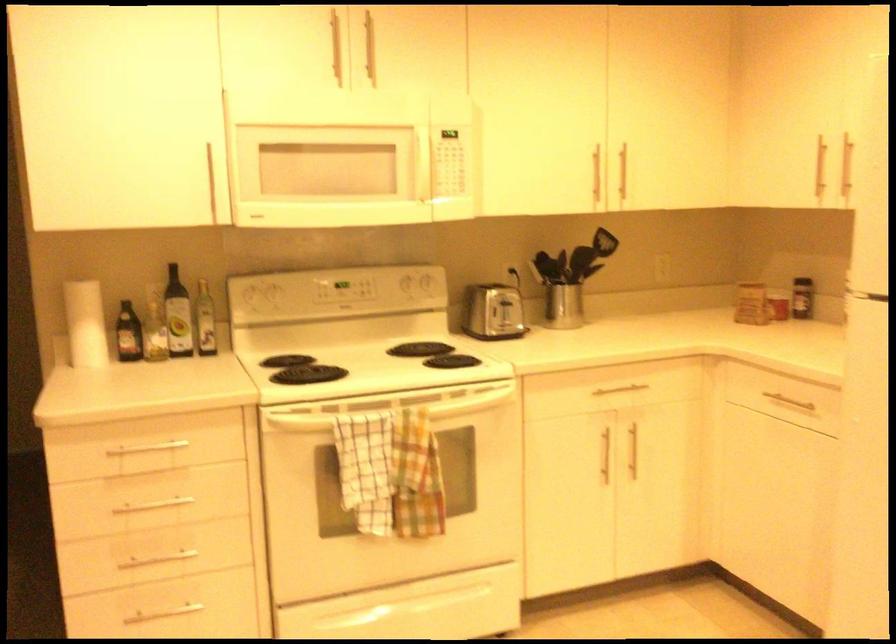
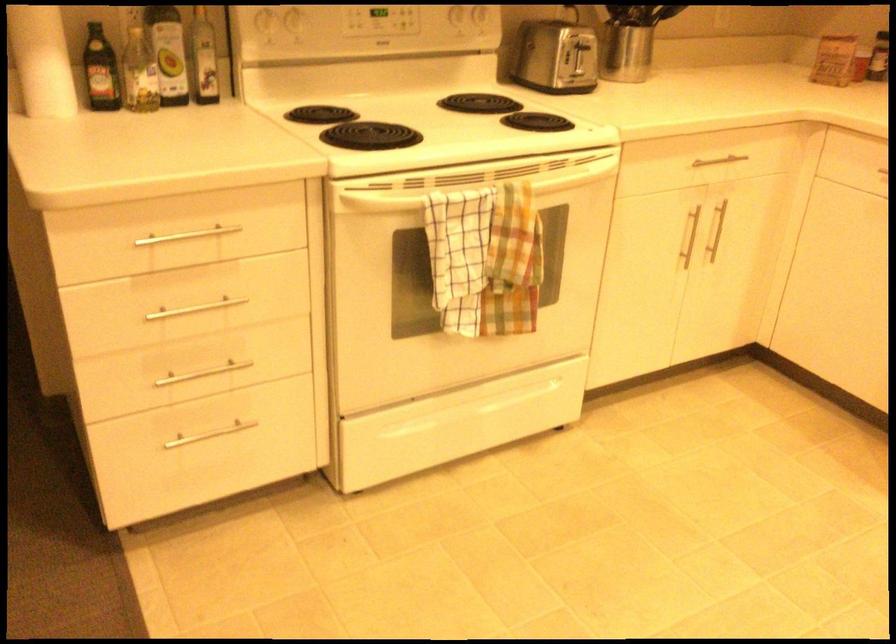
The point at (x=609, y=456) is marked in the first image. Where is the corresponding point in the second image?

(687, 237)